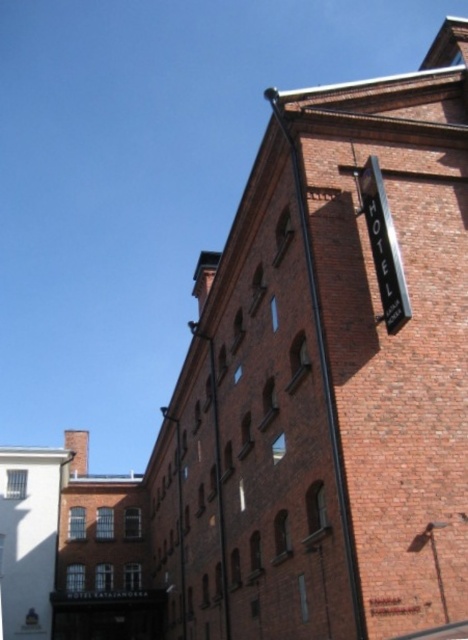
Based on the photo, who is positioned more to the left, black plastic hotel sign at upper right or smooth metal pole at center?

smooth metal pole at center

The width and height of the screenshot is (468, 640). What are the coordinates of `black plastic hotel sign at upper right` in the screenshot? It's located at (382, 246).

Who is more distant from viewer, (x=379, y=186) or (x=224, y=570)?

The point (x=224, y=570) is more distant.

Where is `black plastic hotel sign at upper right`? black plastic hotel sign at upper right is located at coordinates (382, 246).

Find the location of a particular element. This screenshot has width=468, height=640. metallic signboard at upper right is located at coordinates (323, 372).

Between point (365, 636) and point (382, 314), which one is positioned in front?

Point (365, 636) is more forward.

Locate an element on the screen. Image resolution: width=468 pixels, height=640 pixels. metallic signboard at upper right is located at coordinates (323, 372).

Between metallic signboard at upper right and smooth metal pole at center, which one is positioned higher?

metallic signboard at upper right is above.

Is metallic signboard at upper right above smooth metal pole at center?

Indeed, metallic signboard at upper right is positioned over smooth metal pole at center.

This screenshot has width=468, height=640. In order to click on metallic signboard at upper right in this screenshot , I will do `click(323, 372)`.

The height and width of the screenshot is (640, 468). Identify the location of metallic signboard at upper right. (323, 372).